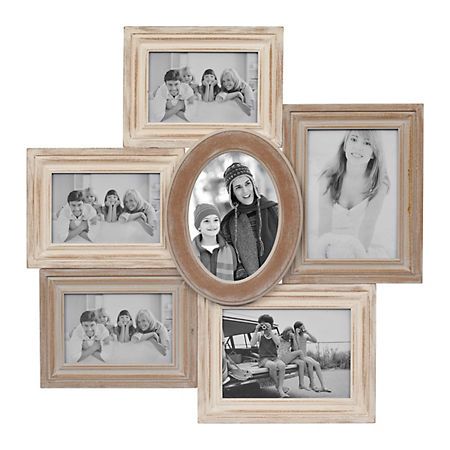
The image size is (450, 450). I want to click on black and white photos, so click(x=375, y=164), click(x=246, y=183), click(x=236, y=91), click(x=120, y=208), click(x=132, y=329), click(x=306, y=352).